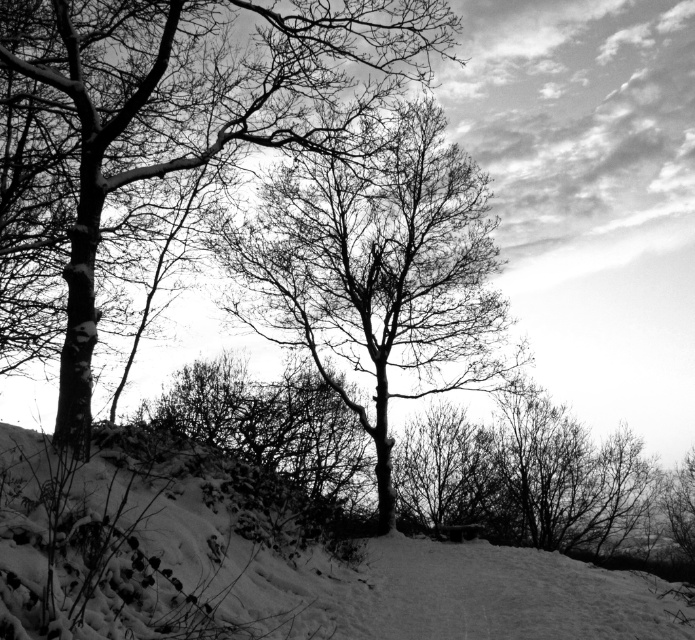
Question: Among these objects, which one is nearest to the camera?

Choices:
 (A) snowy white hillside at lower left
 (B) snow-covered branches at upper center
 (C) bare branches at center

Answer: (A)

Question: Can you confirm if bare branches at center is thinner than snow-covered branches at upper center?

Choices:
 (A) no
 (B) yes

Answer: (B)

Question: Which object is the closest to the snowy white hillside at lower left?

Choices:
 (A) bare branches at center
 (B) snow-covered branches at upper center

Answer: (B)

Question: Is bare branches at center to the right of snow-covered branches at upper center from the viewer's perspective?

Choices:
 (A) yes
 (B) no

Answer: (A)

Question: Which object is closer to the camera taking this photo?

Choices:
 (A) snowy white hillside at lower left
 (B) snow-covered branches at upper center

Answer: (A)

Question: Is bare branches at center thinner than snow-covered branches at upper center?

Choices:
 (A) no
 (B) yes

Answer: (B)